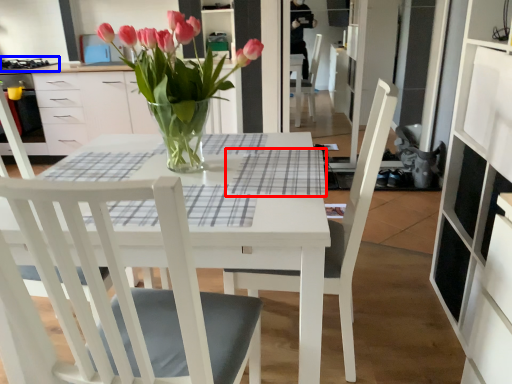
Question: Which point is closer to the camera, plaid (highlighted by a red box) or gas stove (highlighted by a blue box)?

Choices:
 (A) plaid
 (B) gas stove

Answer: (A)